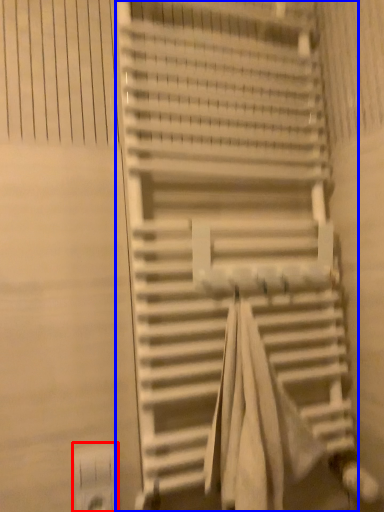
Question: Which point is closer to the camera, electric outlet (highlighted by a red box) or stairs (highlighted by a blue box)?

Choices:
 (A) electric outlet
 (B) stairs

Answer: (B)